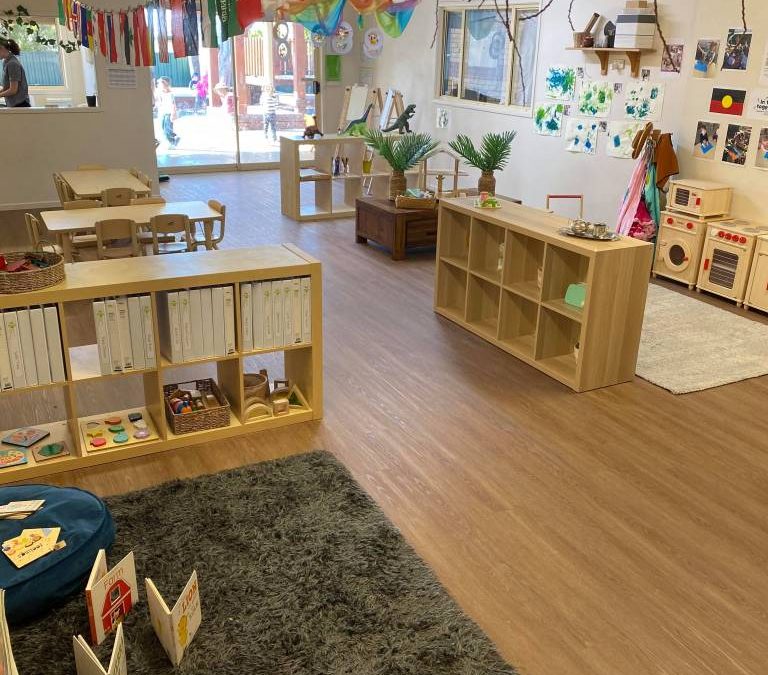
Identify the location of brown desk. (78, 216).